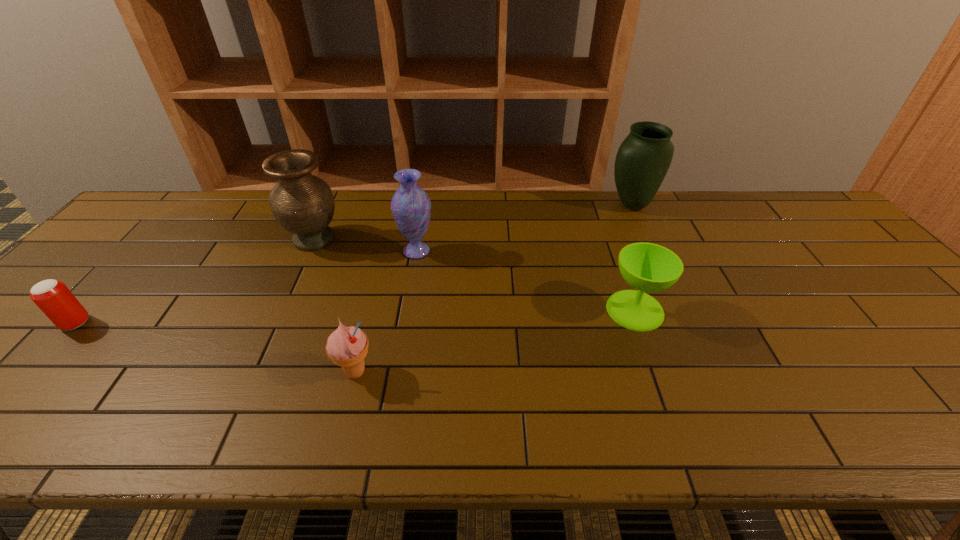
I want to click on free space located on the left of the second vase from right to left, so click(363, 251).

Identify the location of free space located 0.240m on the right of the wineglass. (759, 310).

You are a GUI agent. You are given a task and a screenshot of the screen. Output one action in this format:
    pyautogui.click(x=<x>, y=<y>)
    Task: Click on the vacant space located 0.160m on the left of the nearest object
    Image resolution: width=960 pixels, height=540 pixels.
    Given the screenshot: What is the action you would take?
    pyautogui.click(x=263, y=372)

I want to click on free space located on the right of the beer can, so click(x=176, y=323).

Find the location of a particular element. This screenshot has width=960, height=540. object located at the left edge is located at coordinates (56, 301).

In the image, there is a desktop. At what (x,y) coordinates should I click in order to perform the action: click on vacant area at the far edge. Please return your answer as a coordinate pair (x, y). Looking at the image, I should click on (675, 205).

Locate an element on the screen. The width and height of the screenshot is (960, 540). vacant space at the near edge of the desktop is located at coordinates (539, 408).

Find the location of a particular element. The height and width of the screenshot is (540, 960). free space between the icecream and the second vase from right to left is located at coordinates (386, 312).

The image size is (960, 540). What are the coordinates of `vacant space that is in between the beer can and the farthest object` in the screenshot? It's located at coord(353,264).

At what (x,y) coordinates should I click in order to perform the action: click on vacant area between the icecream and the fifth object from right to left. Please return your answer as a coordinate pair (x, y). This screenshot has width=960, height=540. Looking at the image, I should click on (335, 306).